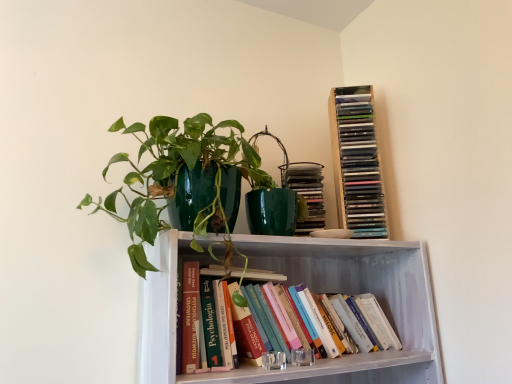
Question: From the image's perspective, would you say hardcover book at center, which is the 2th book in bottom-to-top order, is positioned over matte green book at upper right, marked as the third book in a bottom-to-top arrangement?

Choices:
 (A) no
 (B) yes

Answer: (A)

Question: From a real-world perspective, is hardcover book at center, marked as the 3th book in a top-to-bottom arrangement, over matte green book at upper right, acting as the 2th book starting from the top?

Choices:
 (A) no
 (B) yes

Answer: (A)

Question: Does hardcover book at center, marked as the 3th book in a top-to-bottom arrangement, lie behind matte green book at upper right, acting as the 2th book starting from the top?

Choices:
 (A) yes
 (B) no

Answer: (B)

Question: Is hardcover book at center, which is the 2th book in bottom-to-top order, placed right next to matte green book at upper right, acting as the 2th book starting from the top?

Choices:
 (A) no
 (B) yes

Answer: (A)

Question: From the image's perspective, would you say hardcover book at center, which is the 2th book in bottom-to-top order, is shown under matte green book at upper right, acting as the 2th book starting from the top?

Choices:
 (A) no
 (B) yes

Answer: (B)

Question: Does point (334, 309) appear closer or farther from the camera than point (301, 193)?

Choices:
 (A) farther
 (B) closer

Answer: (B)

Question: Do you think hardcover books at center, positioned as the 4th book in top-to-bottom order, is within matte green book at upper right, acting as the 2th book starting from the top, or outside of it?

Choices:
 (A) inside
 (B) outside

Answer: (B)

Question: From a real-world perspective, is hardcover books at center, positioned as the 4th book in top-to-bottom order, physically located above or below matte green book at upper right, marked as the third book in a bottom-to-top arrangement?

Choices:
 (A) below
 (B) above

Answer: (A)

Question: Visually, is hardcover books at center, positioned as the 4th book in top-to-bottom order, positioned to the left or to the right of matte green book at upper right, marked as the third book in a bottom-to-top arrangement?

Choices:
 (A) left
 (B) right

Answer: (A)

Question: Is hardcover books at center, which is the first book in bottom-to-top order, in front of or behind green glossy pot at upper center in the image?

Choices:
 (A) front
 (B) behind

Answer: (B)

Question: Looking at their shapes, would you say hardcover books at center, positioned as the 4th book in top-to-bottom order, is wider or thinner than green glossy pot at upper center?

Choices:
 (A) thin
 (B) wide

Answer: (A)

Question: Is hardcover books at center, which is the first book in bottom-to-top order, situated inside green glossy pot at upper center or outside?

Choices:
 (A) outside
 (B) inside

Answer: (A)

Question: In terms of height, does hardcover books at center, which is the first book in bottom-to-top order, look taller or shorter compared to green glossy pot at upper center?

Choices:
 (A) tall
 (B) short

Answer: (B)

Question: From a real-world perspective, relative to matte green book at upper right, marked as the third book in a bottom-to-top arrangement, is hardcover book at center, marked as the 3th book in a top-to-bottom arrangement, vertically above or below?

Choices:
 (A) above
 (B) below

Answer: (B)

Question: Is hardcover book at center, which is the 2th book in bottom-to-top order, wider or thinner than matte green book at upper right, acting as the 2th book starting from the top?

Choices:
 (A) thin
 (B) wide

Answer: (A)